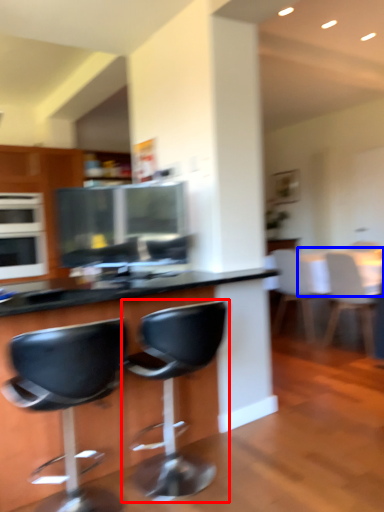
Question: Which object appears farthest to the camera in this image, chair (highlighted by a red box) or table (highlighted by a blue box)?

Choices:
 (A) chair
 (B) table

Answer: (B)